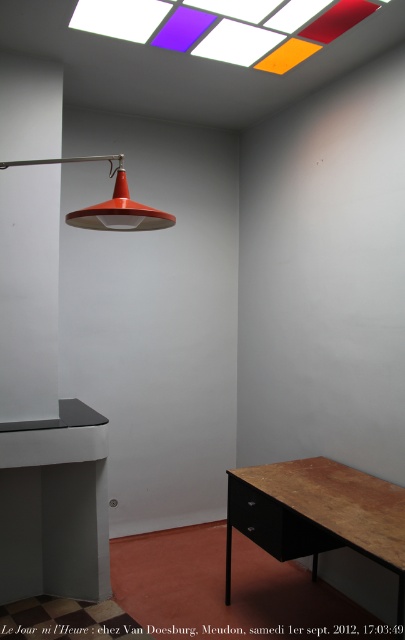
You are standing in the room and want to look outside through the translucent glass window at upper center. Where should you look to see outside?

You should look at the translucent glass window at upper center located at the coordinates point (226, 26) to see outside.